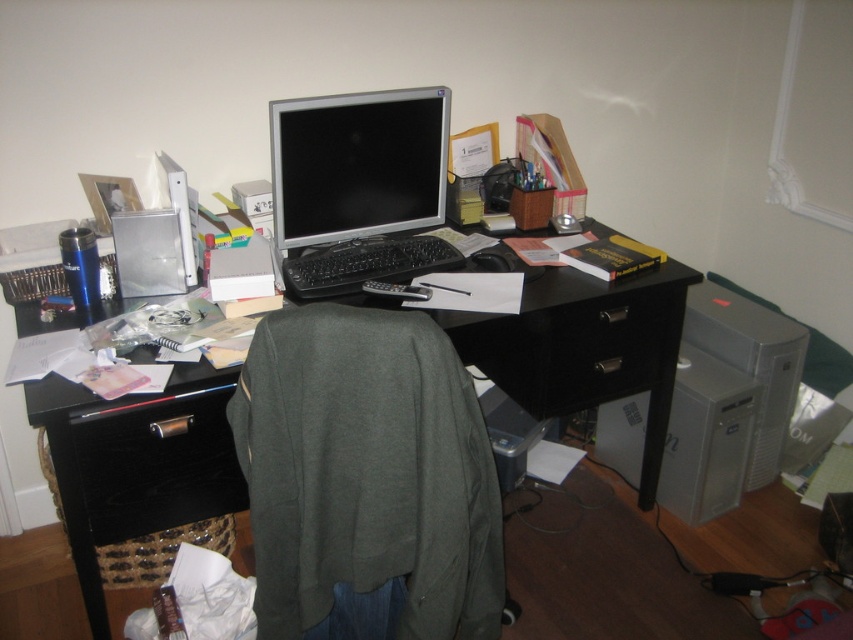
Between black matte computer desk at center and black wood drawer at lower left, which one has more height?

With more height is black matte computer desk at center.

Can you confirm if black matte computer desk at center is positioned below black wood drawer at lower left?

Yes, black matte computer desk at center is below black wood drawer at lower left.

What do you see at coordinates (137, 464) in the screenshot? The height and width of the screenshot is (640, 853). I see `black matte computer desk at center` at bounding box center [137, 464].

The height and width of the screenshot is (640, 853). Find the location of `black matte computer desk at center`. black matte computer desk at center is located at coordinates (137, 464).

In the scene shown: Can you confirm if silver metallic monitor at center is smaller than black wood drawer at lower left?

No, silver metallic monitor at center is not smaller than black wood drawer at lower left.

Identify the location of silver metallic monitor at center. This screenshot has height=640, width=853. (357, 164).

Does point (434, 205) lie in front of point (134, 428)?

No, (434, 205) is further to viewer.

You are a GUI agent. You are given a task and a screenshot of the screen. Output one action in this format:
    pyautogui.click(x=<x>, y=<y>)
    Task: Click on the silver metallic monitor at center
    Image resolution: width=853 pixels, height=640 pixels.
    Given the screenshot: What is the action you would take?
    pyautogui.click(x=357, y=164)

Is black wood drawer at lower left in front of black plastic drawer at center?

Yes, black wood drawer at lower left is closer to the viewer.

Based on the photo, can you confirm if black wood drawer at lower left is positioned below black plastic drawer at center?

Yes.

Consider the image. Measure the distance between black wood drawer at lower left and camera.

black wood drawer at lower left is 4.66 feet from camera.

Locate an element on the screen. black wood drawer at lower left is located at coordinates (155, 464).